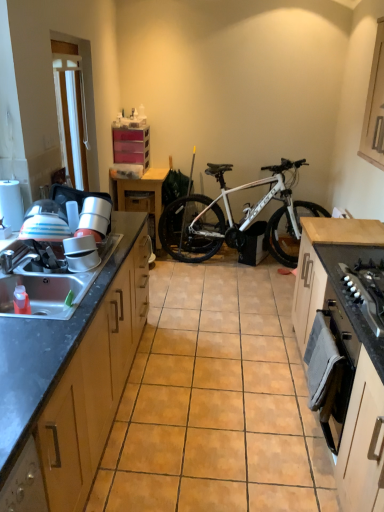
Where is `vacant space that's between white matte oven at right, placed as the 2th cabinetry when sorted from right to left, and white metallic bicycle at center`? vacant space that's between white matte oven at right, placed as the 2th cabinetry when sorted from right to left, and white metallic bicycle at center is located at coordinates (244, 317).